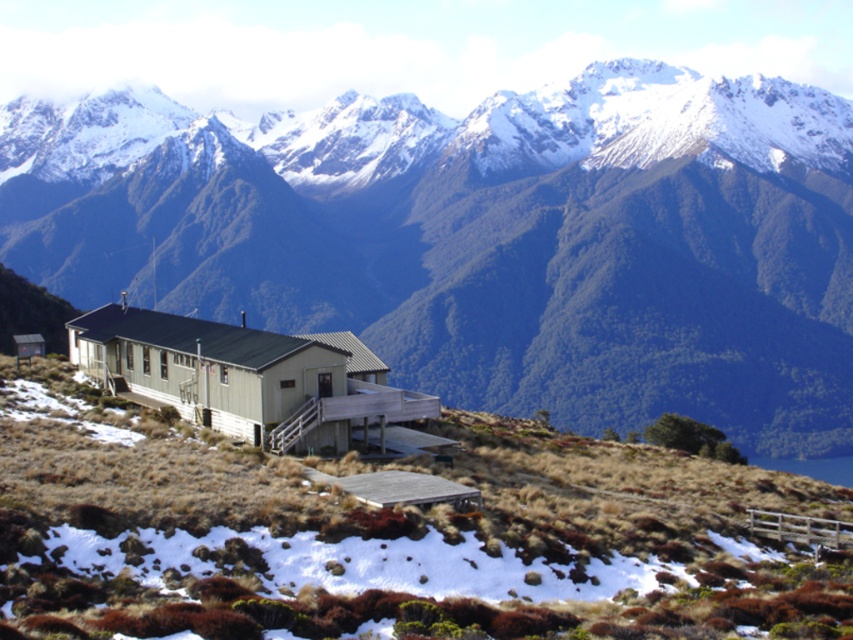
Question: Which point is farther to the camera?

Choices:
 (A) (45, 176)
 (B) (381, 576)

Answer: (A)

Question: Which point is farther to the camera?

Choices:
 (A) (814, 616)
 (B) (712, 420)

Answer: (B)

Question: Which object appears farthest from the camera in this image?

Choices:
 (A) snowy rock mountain range at upper center
 (B) green wood hillside at center

Answer: (A)

Question: Is snowy rock mountain range at upper center smaller than green wood hillside at center?

Choices:
 (A) no
 (B) yes

Answer: (A)

Question: Does snowy rock mountain range at upper center come behind green wood hillside at center?

Choices:
 (A) no
 (B) yes

Answer: (B)

Question: Is snowy rock mountain range at upper center in front of green wood hillside at center?

Choices:
 (A) yes
 (B) no

Answer: (B)